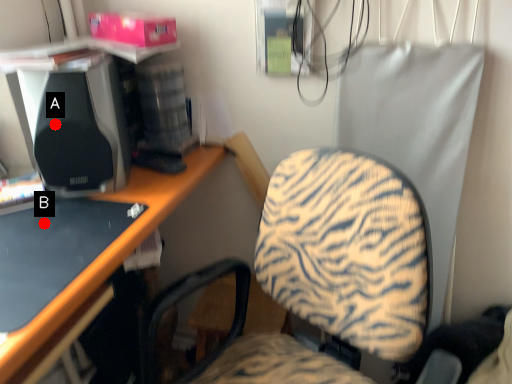
Question: Two points are circled on the image, labeled by A and B beside each circle. Which point is closer to the camera taking this photo?

Choices:
 (A) A is closer
 (B) B is closer

Answer: (B)